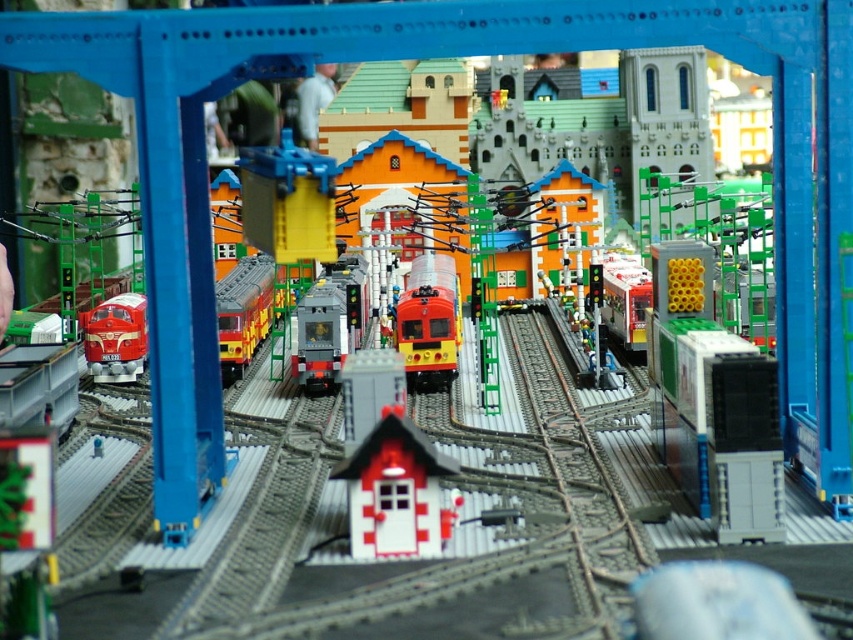
You are a Lego enthusiast trying to fit both the shiny red train at center and the shiny yellow train at center onto a display shelf. The shelf has a width of 1 meter. Given their sizes, can both trains fit side by side without overlapping?

The shiny red train at center is narrower than the shiny yellow train at center. However, without knowing the exact widths of both trains, it is impossible to determine if their combined width is less than 1 meter. Additional information about their individual dimensions is required to answer this question accurately.

You are a visitor at a Lego exhibition and see the shiny red train at center and the shiny yellow train at center. Which one do you think is closer to you?

The shiny red train at center is closer to the viewer than the shiny yellow train at center.